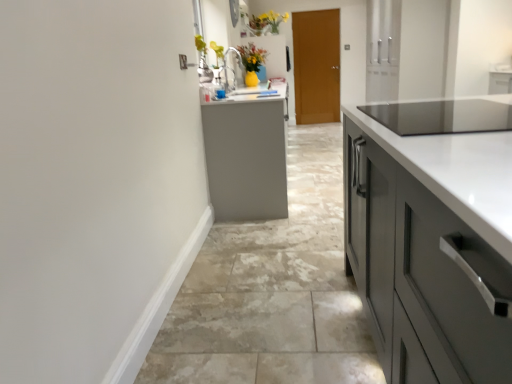
Question: Is gray tile floor at center bigger or smaller than yellow matte vase at upper center?

Choices:
 (A) big
 (B) small

Answer: (A)

Question: Considering the positions of point (247, 299) and point (276, 16), is point (247, 299) closer or farther from the camera than point (276, 16)?

Choices:
 (A) closer
 (B) farther

Answer: (A)

Question: Which object is the farthest from the gray tile floor at center?

Choices:
 (A) brown wooden door at center
 (B) yellow matte vase at upper center

Answer: (B)

Question: Estimate the real-world distances between objects in this image. Which object is closer to the yellow matte vase at upper center?

Choices:
 (A) brown wooden door at center
 (B) gray tile floor at center

Answer: (A)